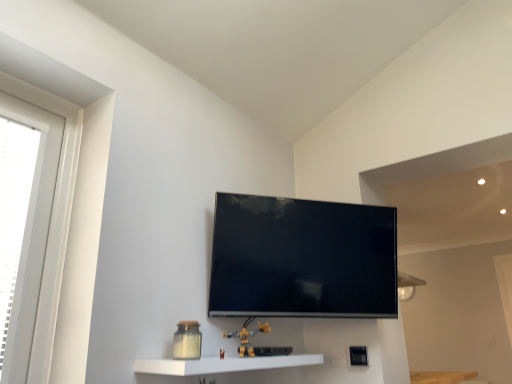
Question: Considering the positions of yellow plastic toy at lower center and white glossy shelf at lower center in the image, is yellow plastic toy at lower center bigger or smaller than white glossy shelf at lower center?

Choices:
 (A) small
 (B) big

Answer: (A)

Question: From a real-world perspective, is yellow plastic toy at lower center above or below white glossy shelf at lower center?

Choices:
 (A) below
 (B) above

Answer: (B)

Question: Based on their relative distances, which object is nearer to the yellow plastic toy at lower center?

Choices:
 (A) white glossy shelf at lower center
 (B) flat screen tv at center
 (C) white plastic window at left

Answer: (A)

Question: Estimate the real-world distances between objects in this image. Which object is farther from the yellow plastic toy at lower center?

Choices:
 (A) white glossy shelf at lower center
 (B) white plastic window at left
 (C) flat screen tv at center

Answer: (B)